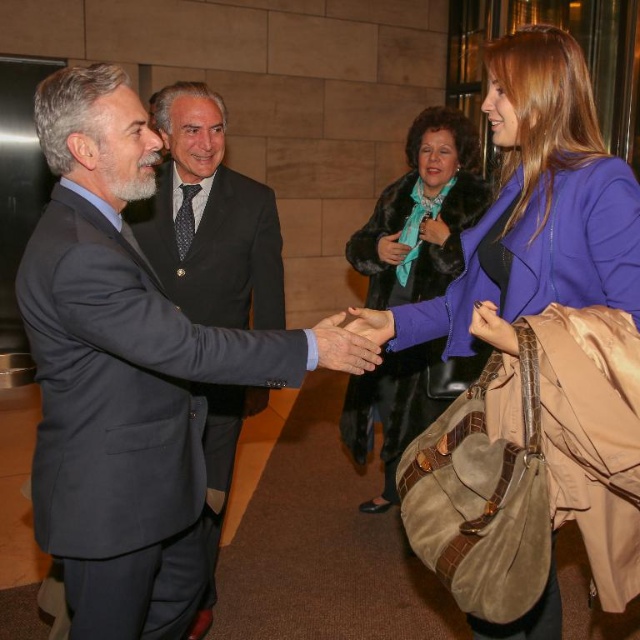
Question: Can you confirm if dark blue suit at center is wider than velvet teal scarf at center?

Choices:
 (A) yes
 (B) no

Answer: (B)

Question: Is purple suede coat at center to the right of velvet teal scarf at center from the viewer's perspective?

Choices:
 (A) no
 (B) yes

Answer: (B)

Question: Which object is farther from the camera taking this photo?

Choices:
 (A) velvet teal scarf at center
 (B) dark gray wool suit at center
 (C) purple suede coat at center

Answer: (A)

Question: Does purple suede coat at center appear under velvet teal scarf at center?

Choices:
 (A) no
 (B) yes

Answer: (A)

Question: Which of the following is the closest to the observer?

Choices:
 (A) purple suede coat at center
 (B) dark blue suit at center
 (C) velvet teal scarf at center
 (D) dark gray wool suit at center

Answer: (D)

Question: Which point is farther from the camera taking this photo?

Choices:
 (A) (173, 198)
 (B) (44, 520)
 (C) (378, 406)
 (D) (566, 192)

Answer: (C)